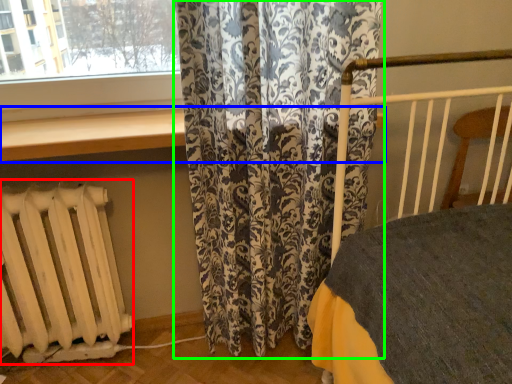
Question: Which is nearer to the radiator (highlighted by a red box)? window sill (highlighted by a blue box) or curtain (highlighted by a green box).

Choices:
 (A) window sill
 (B) curtain

Answer: (A)